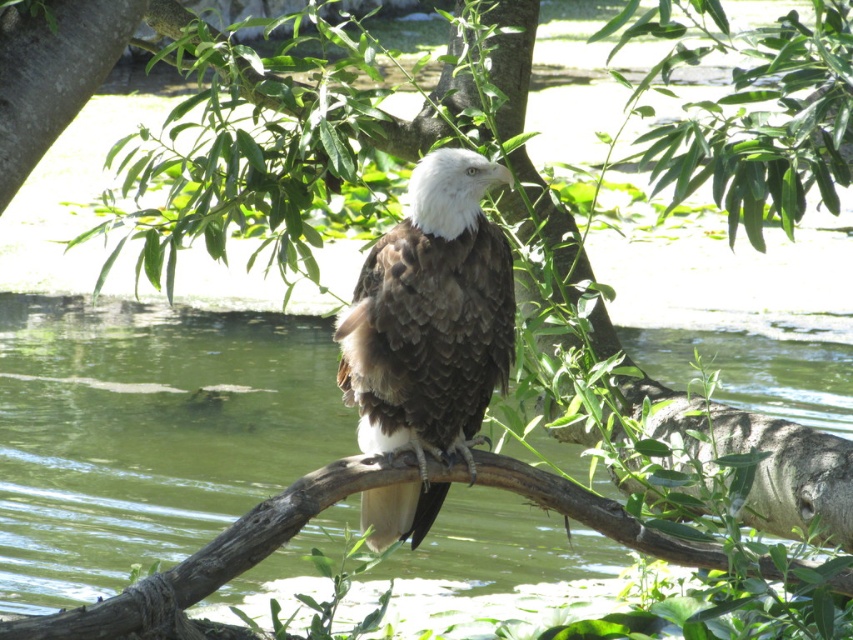
Question: Does brown feathered bald eagle at center have a greater width compared to brown rough tree branch at center?

Choices:
 (A) yes
 (B) no

Answer: (B)

Question: Is brown feathered bald eagle at center positioned behind brown rough tree branch at center?

Choices:
 (A) yes
 (B) no

Answer: (A)

Question: Which point is farther from the camera taking this photo?

Choices:
 (A) (61, 616)
 (B) (438, 509)

Answer: (B)

Question: From the image, what is the correct spatial relationship of brown feathered bald eagle at center in relation to brown rough tree branch at center?

Choices:
 (A) below
 (B) above

Answer: (B)